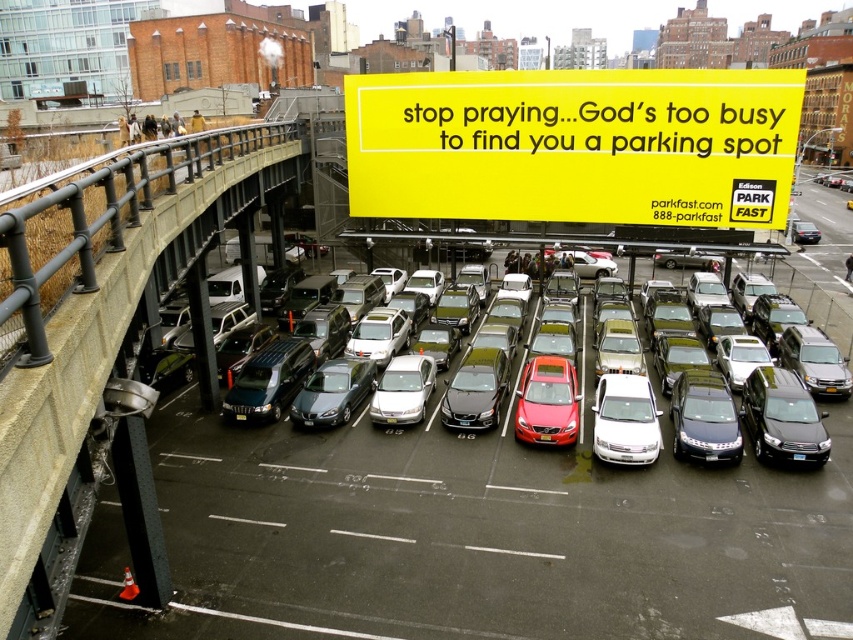
You are a driver looking for parking in the city. You see a shiny red sedan at center and a satin black sedan at center. Which car is parked higher up in the parking lot?

The shiny red sedan at center is located above the satin black sedan at center, so it is parked higher up in the parking lot.

You are a parking attendant who needs to fit a compact car into a parking space. You see the white glossy sedan at center and the metallic gray sedan at center. Which car can you fit into a standard parking space more easily?

The white glossy sedan at center has a smaller width than the metallic gray sedan at center, so it can be more easily fit into a standard parking space.

Based on the photo, you are a driver looking for parking in this busy lot. You see a shiny red sedan at center and a metallic gray sedan at center. Which car should you avoid parking behind to ensure your rear visibility isn?t blocked?

You should avoid parking behind the metallic gray sedan at center because the shiny red sedan at center is closer to the viewer, meaning the metallic gray sedan is further back and would block your rear visibility more.